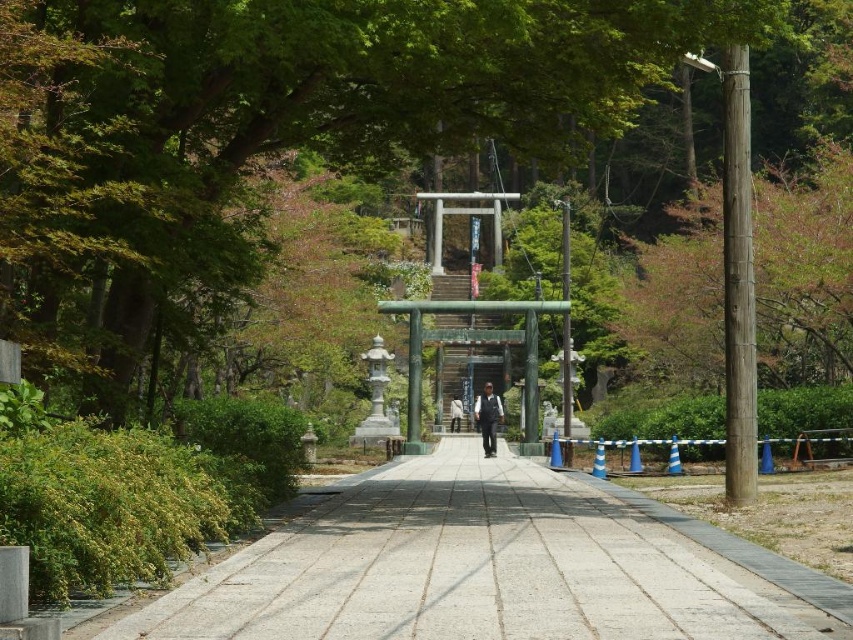
Question: Does gray concrete pavement at center appear on the right side of black fabric jacket at center?

Choices:
 (A) yes
 (B) no

Answer: (B)

Question: Does gray concrete pavement at center appear on the left side of green polished stone torii gate at center?

Choices:
 (A) yes
 (B) no

Answer: (A)

Question: Which of the following is the closest to the observer?

Choices:
 (A) black fabric jacket at center
 (B) green polished stone torii gate at center
 (C) black fabric pants at center

Answer: (A)

Question: Which point appears farthest from the camera in this image?

Choices:
 (A) (502, 376)
 (B) (497, 420)

Answer: (A)

Question: Can you confirm if black fabric jacket at center is positioned above black fabric pants at center?

Choices:
 (A) no
 (B) yes

Answer: (B)

Question: Which object is the closest to the green polished stone torii gate at center?

Choices:
 (A) black fabric jacket at center
 (B) green leafy tree at center

Answer: (A)